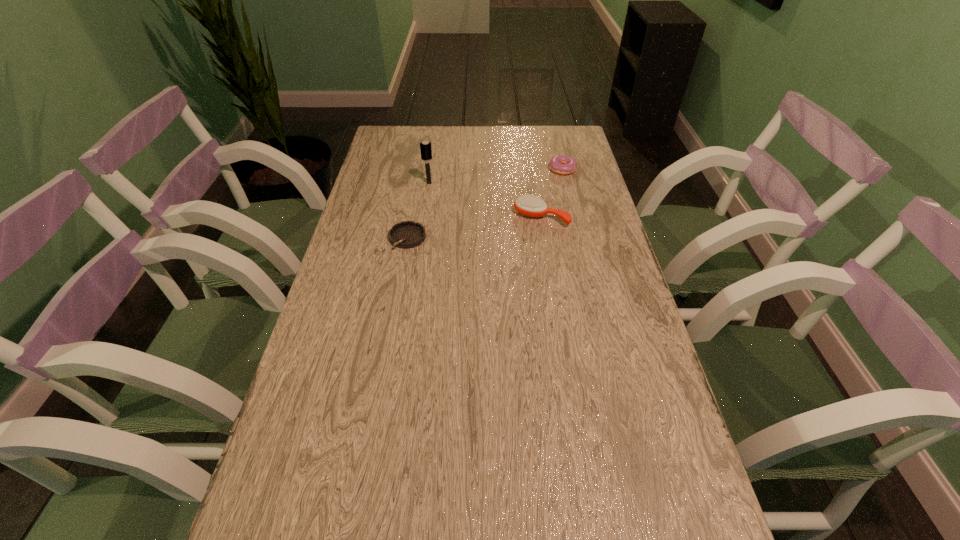
Where is `the left hairbrush`? Image resolution: width=960 pixels, height=540 pixels. the left hairbrush is located at coordinates (425, 147).

In order to click on the taller hairbrush in this screenshot , I will do `click(425, 147)`.

Find the location of `the shorter hairbrush`. the shorter hairbrush is located at coordinates (529, 205).

The width and height of the screenshot is (960, 540). I want to click on the second tallest object, so click(529, 205).

At what (x,y) coordinates should I click in order to perform the action: click on the farthest object. Please return your answer as a coordinate pair (x, y). Looking at the image, I should click on (x=562, y=164).

Identify the location of the third tallest object. (562, 164).

I want to click on ashtray, so click(407, 234).

I want to click on free location located 0.190m on the back of the taller hairbrush, so click(x=434, y=150).

Find the location of a particular element. The image size is (960, 540). free space located on the front of the right hairbrush is located at coordinates (559, 326).

Where is `free space located 0.240m on the back of the doughnut`? This screenshot has height=540, width=960. free space located 0.240m on the back of the doughnut is located at coordinates (552, 126).